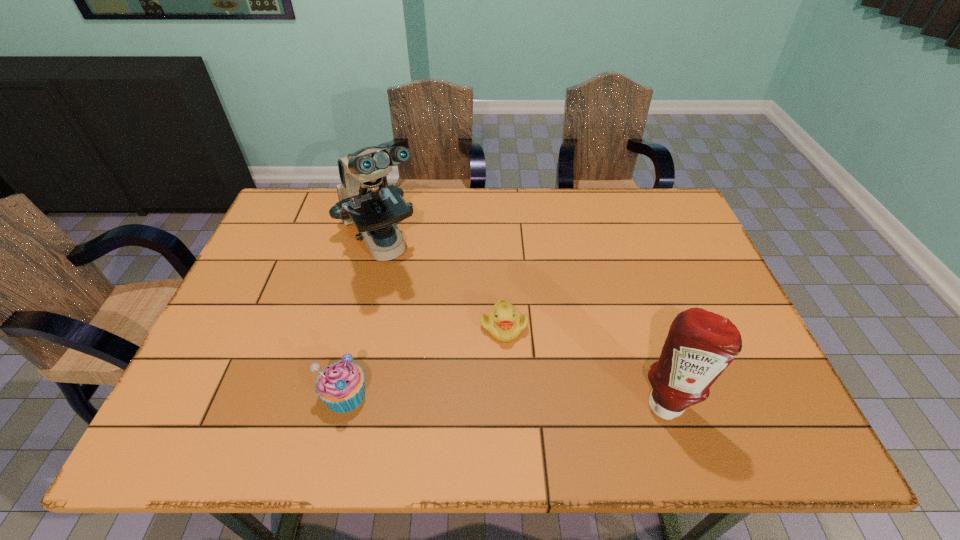
This screenshot has width=960, height=540. In order to click on free region located through the eyepieces of the farthest object in this screenshot , I will do `click(452, 373)`.

At what (x,y) coordinates should I click in order to perform the action: click on free region located through the eyepieces of the farthest object. Please return your answer as a coordinate pair (x, y). This screenshot has height=540, width=960. Looking at the image, I should click on (409, 301).

The height and width of the screenshot is (540, 960). I want to click on free space located on the front-facing side of the third nearest object, so click(541, 390).

What are the coordinates of `object present at the far edge` in the screenshot? It's located at (374, 210).

The width and height of the screenshot is (960, 540). Find the location of `muffin that is at the near edge`. muffin that is at the near edge is located at coordinates coord(340,385).

At what (x,y) coordinates should I click in order to perform the action: click on condiment present at the near edge. Please return your answer as a coordinate pair (x, y). Looking at the image, I should click on [700, 345].

At what (x,y) coordinates should I click in order to perform the action: click on free space at the far edge. Please return your answer as a coordinate pair (x, y). Looking at the image, I should click on coord(550,212).

The height and width of the screenshot is (540, 960). I want to click on free spot at the near edge of the desktop, so click(x=315, y=396).

The image size is (960, 540). Identify the location of vacant region at the left edge of the desktop. click(290, 261).

Locate an element on the screen. The height and width of the screenshot is (540, 960). free space at the right edge is located at coordinates (671, 273).